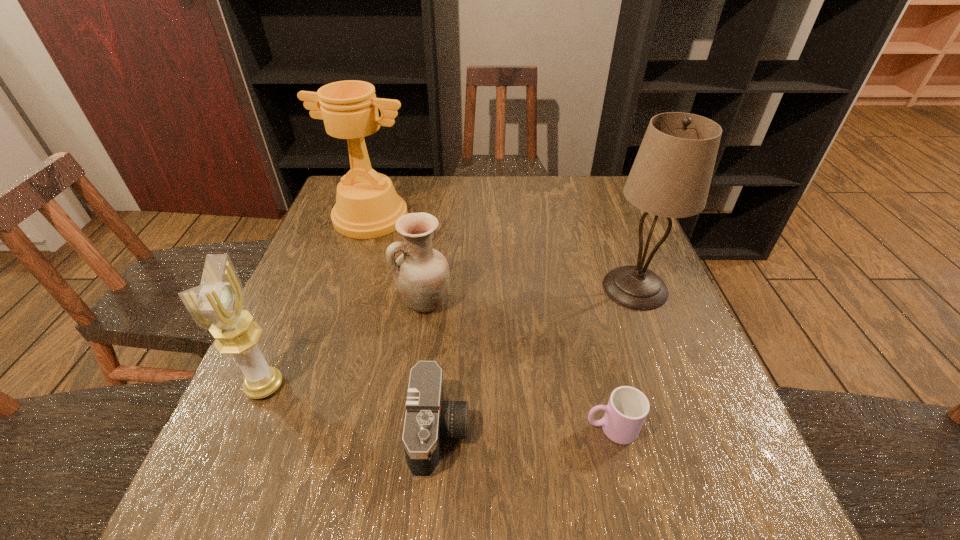
At what (x,y) coordinates should I click in order to perform the action: click on unoccupied area between the shortest object and the lampshade. Please return your answer as a coordinate pair (x, y). Looking at the image, I should click on [x=623, y=358].

You are a GUI agent. You are given a task and a screenshot of the screen. Output one action in this format:
    pyautogui.click(x=<x>, y=<y>)
    Task: Click on the free spot between the lampshade and the farthest object
    The height and width of the screenshot is (540, 960).
    Given the screenshot: What is the action you would take?
    (503, 253)

What are the coordinates of `vacant space in between the lampshade and the shorter award` in the screenshot? It's located at (450, 337).

Where is `empty location between the shorter award and the fourth tallest object`? empty location between the shorter award and the fourth tallest object is located at coordinates (345, 344).

At what (x,y) coordinates should I click in order to perform the action: click on vacant space in between the pottery and the lampshade. Please return your answer as a coordinate pair (x, y). Looking at the image, I should click on (530, 295).

This screenshot has width=960, height=540. Find the location of `object that is the second closest to the rightmost object`. object that is the second closest to the rightmost object is located at coordinates tap(421, 274).

Find the location of a particular element. object that can be found as the fourth closest to the lampshade is located at coordinates (367, 206).

Where is `free space that satisfies the following two spatial constraints: 1. on the front side of the fourth tallest object; 2. with the handle on the side of the cup`? free space that satisfies the following two spatial constraints: 1. on the front side of the fourth tallest object; 2. with the handle on the side of the cup is located at coordinates (407, 428).

Identify the location of free location that satisfies the following two spatial constraints: 1. with the handle on the side of the shortest object; 2. on the front side of the pottery. (581, 302).

Locate an element on the screen. The width and height of the screenshot is (960, 540). free location that satisfies the following two spatial constraints: 1. on the front-facing side of the shorter award; 2. with the handle on the side of the cup is located at coordinates (247, 428).